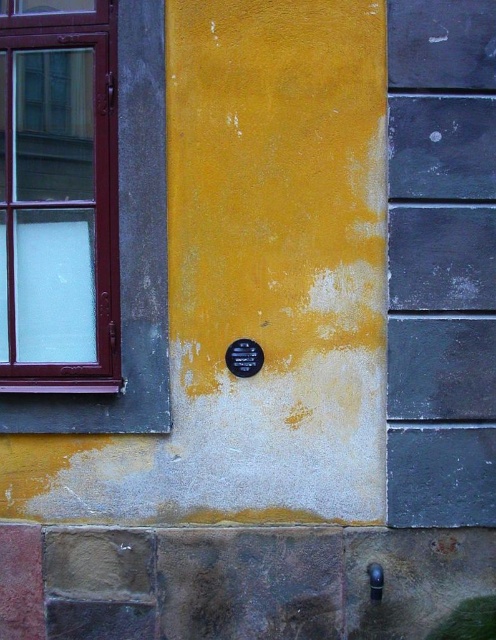
Question: Is matte glass window at left above black metal plaque at center?

Choices:
 (A) yes
 (B) no

Answer: (A)

Question: Among these objects, which one is nearest to the camera?

Choices:
 (A) black metal plaque at center
 (B) matte glass window at left

Answer: (B)

Question: Which of the following is the closest to the observer?

Choices:
 (A) (239, 349)
 (B) (99, 205)

Answer: (A)

Question: Observing the image, what is the correct spatial positioning of matte glass window at left in reference to black metal plaque at center?

Choices:
 (A) above
 (B) below

Answer: (A)

Question: Among these objects, which one is nearest to the camera?

Choices:
 (A) matte glass window at left
 (B) black metal plaque at center

Answer: (A)

Question: In this image, where is matte glass window at left located relative to black metal plaque at center?

Choices:
 (A) left
 (B) right

Answer: (A)